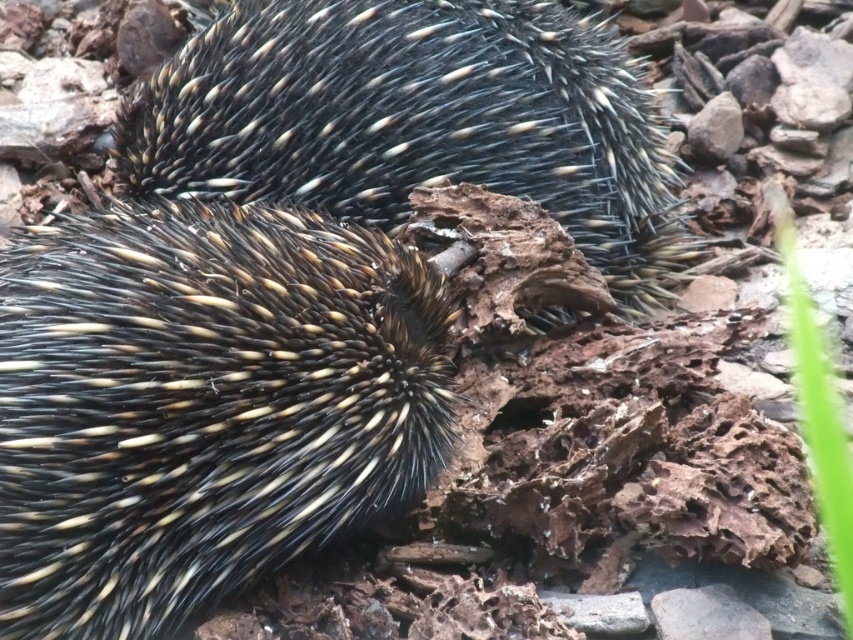
You are an ecologist observing two echidnas in their natural habitat. You notice the black spiny hedgehog at center and the spiny black hedgehog at center. Which one do you see first due to their positioning?

The black spiny hedgehog at center is in front of the spiny black hedgehog at center, so you see the black spiny hedgehog at center first.

You are a wildlife photographer aiming to capture a clear photo of both the black spiny hedgehog at center and the spiny black hedgehog at center. Given that your camera has a depth of field that can focus on objects within a 30 inch range, will both hedgehogs be in focus simultaneously?

The black spiny hedgehog at center is 35.35 inches away from the spiny black hedgehog at center. Since the distance between them exceeds the camera s 30 inch depth of field range, both hedgehogs cannot be in focus simultaneously.

You are a wildlife photographer trying to capture a clear photo of both the black spiny hedgehog at center and the spiny black hedgehog at center. Since they are overlapping, which one should you focus on to ensure the other remains partially visible in the background?

The black spiny hedgehog at center is thinner than the spiny black hedgehog at center, so focusing on the thinner one would allow the thicker spiny black hedgehog at center to still be partially visible behind it.